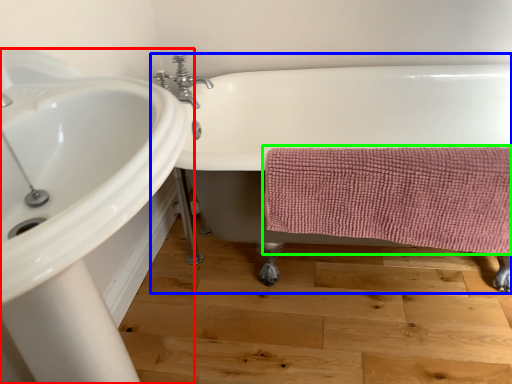
Question: Which object is positioned farthest from sink (highlighted by a red box)? Select from bathtub (highlighted by a blue box) and bath towel (highlighted by a green box).

Choices:
 (A) bathtub
 (B) bath towel

Answer: (A)